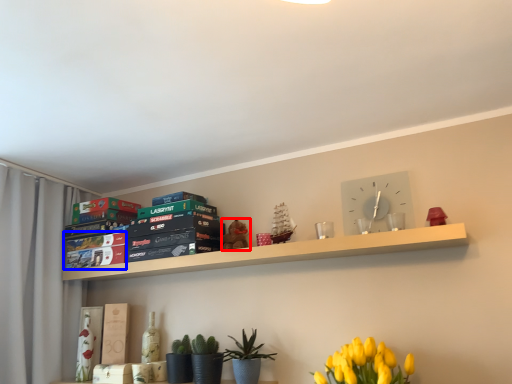
Question: Which object is closer to the camera taking this photo, toy (highlighted by a red box) or paperback book (highlighted by a blue box)?

Choices:
 (A) toy
 (B) paperback book

Answer: (A)